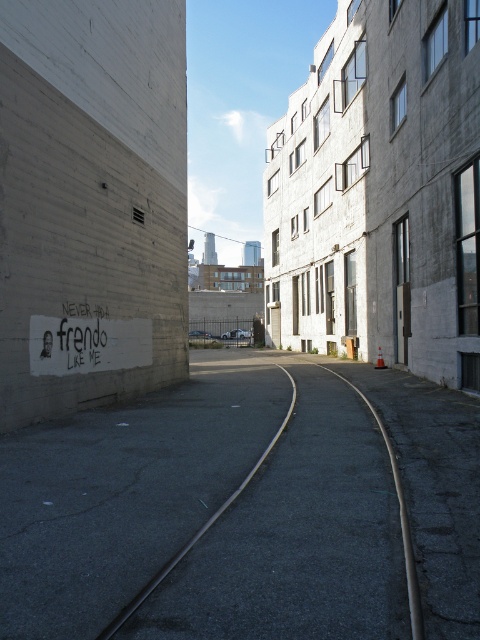
Consider the image. You are standing at the entrance of the alleyway and see the black asphalt track at center. If you walk straight ahead, will you eventually reach the end of the track?

The black asphalt track at center curves gently to the right and disappears into the distance, so walking straight ahead will not lead you directly to its end. You would need to follow the curve of the track to reach its end.

You are standing at the point marked by coordinates (x=197, y=529) in the image. What object are you standing on?

You are standing on the black asphalt track at center marked by the point (x=197, y=529).